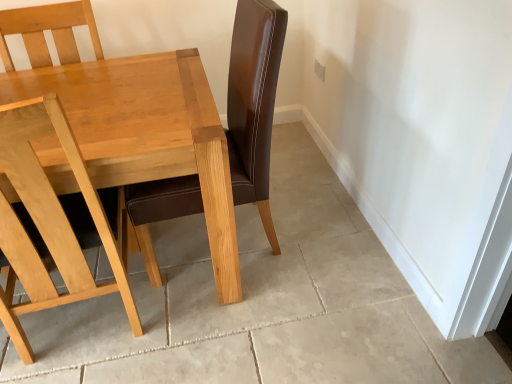
Find the location of a particular element. The image size is (512, 384). blank space situated above light wood table at center (from a real-world perspective) is located at coordinates (114, 99).